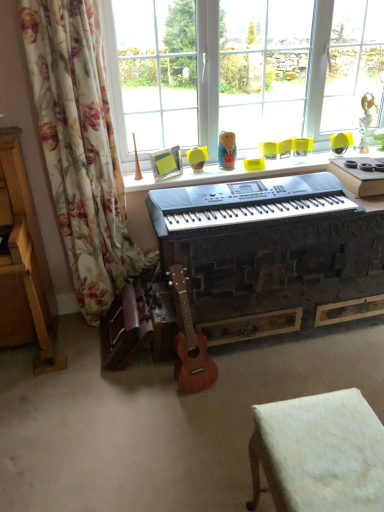
Question: Looking at their shapes, would you say wooden acoustic guitar at center is wider or thinner than black plastic keyboard at center?

Choices:
 (A) wide
 (B) thin

Answer: (B)

Question: Is wooden acoustic guitar at center inside or outside of black plastic keyboard at center?

Choices:
 (A) inside
 (B) outside

Answer: (B)

Question: Which is farther from the transparent glass window at upper center?

Choices:
 (A) matte yellow armchair at center
 (B) white fabric stool at lower right
 (C) black plastic keyboard at center
 (D) floral fabric curtain at left
 (E) wooden acoustic guitar at center

Answer: (B)

Question: Which object is positioned closest to the transparent glass window at upper center?

Choices:
 (A) floral fabric curtain at left
 (B) white fabric stool at lower right
 (C) matte yellow armchair at center
 (D) black plastic keyboard at center
 (E) matte plastic doll at upper center

Answer: (E)